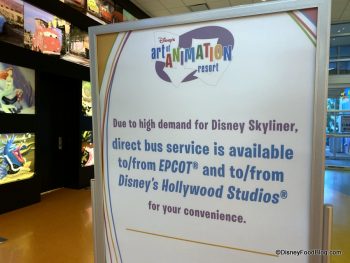
Where is `floor to right of sign`? The width and height of the screenshot is (350, 263). floor to right of sign is located at coordinates (338, 196).